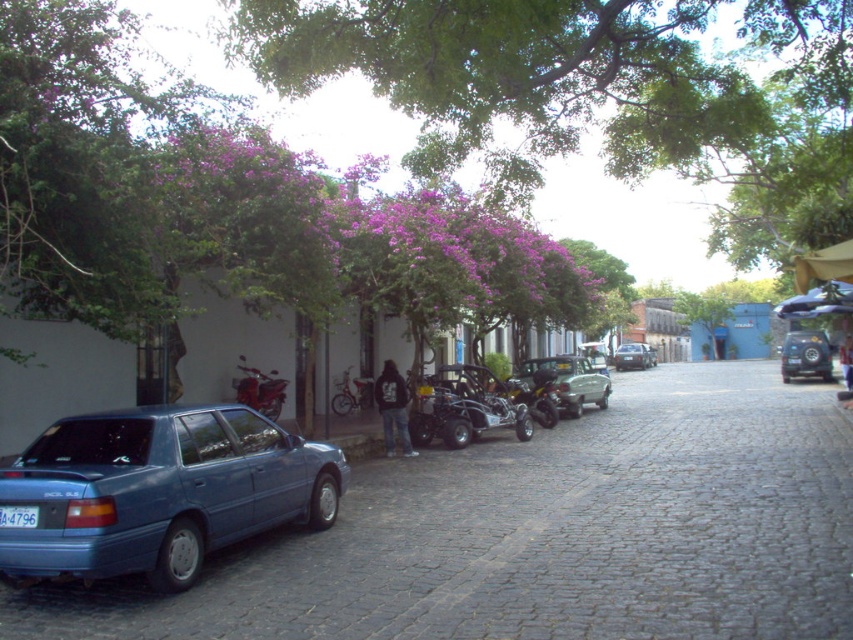
You are a delivery driver who needs to park your vehicle between the shiny black suv at center right and the metallic silver motorcycle at center. The parking spot requires a minimum of 15 meters between vehicles. Can you safely park here?

The distance between the shiny black suv at center right and the metallic silver motorcycle at center is 16.38 meters, which is more than the required 15 meters. Therefore, you can safely park your vehicle between them.